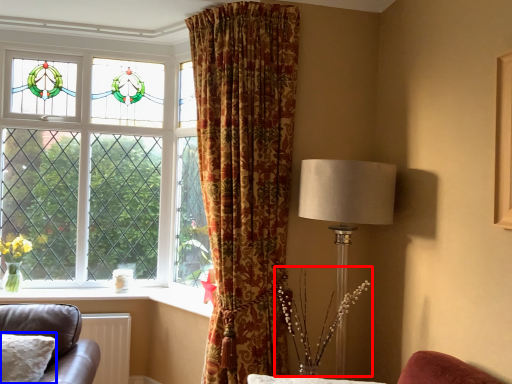
Question: Which point is further to the camera, floral arrangement (highlighted by a red box) or pillow (highlighted by a blue box)?

Choices:
 (A) floral arrangement
 (B) pillow

Answer: (A)